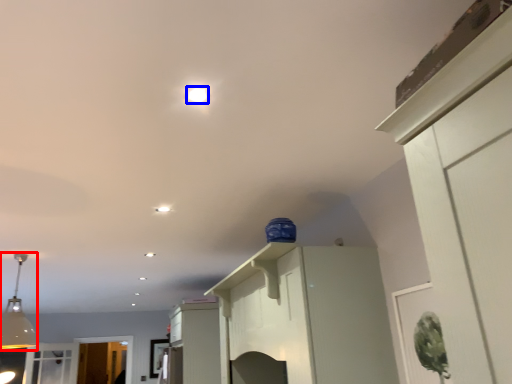
Question: Among these objects, which one is farthest to the camera, light fixture (highlighted by a red box) or lighting (highlighted by a blue box)?

Choices:
 (A) light fixture
 (B) lighting

Answer: (A)